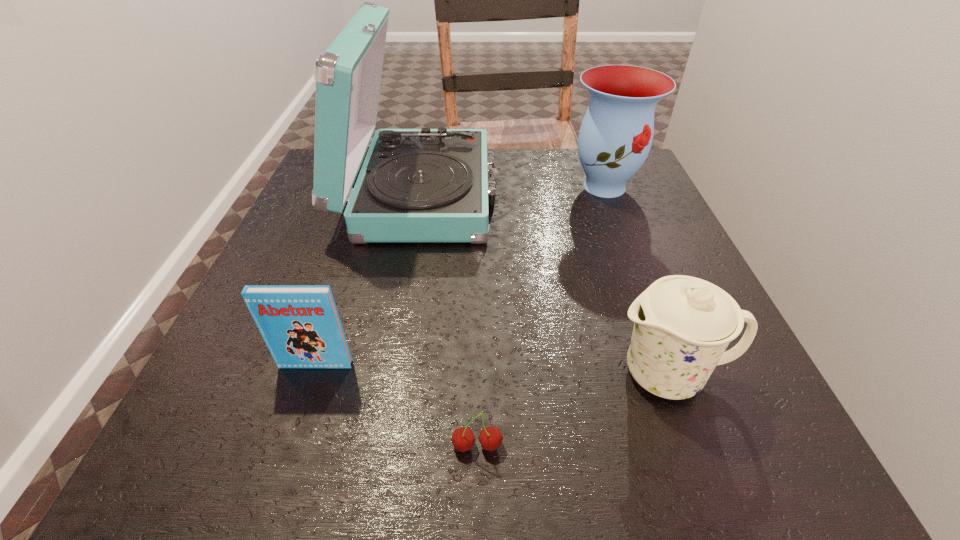
At what (x,y) coordinates should I click in order to perform the action: click on free space that satisfies the following two spatial constraints: 1. on the face side of the record player; 2. on the front cover of the book. Please return your answer as a coordinate pair (x, y). This screenshot has height=540, width=960. Looking at the image, I should click on (391, 364).